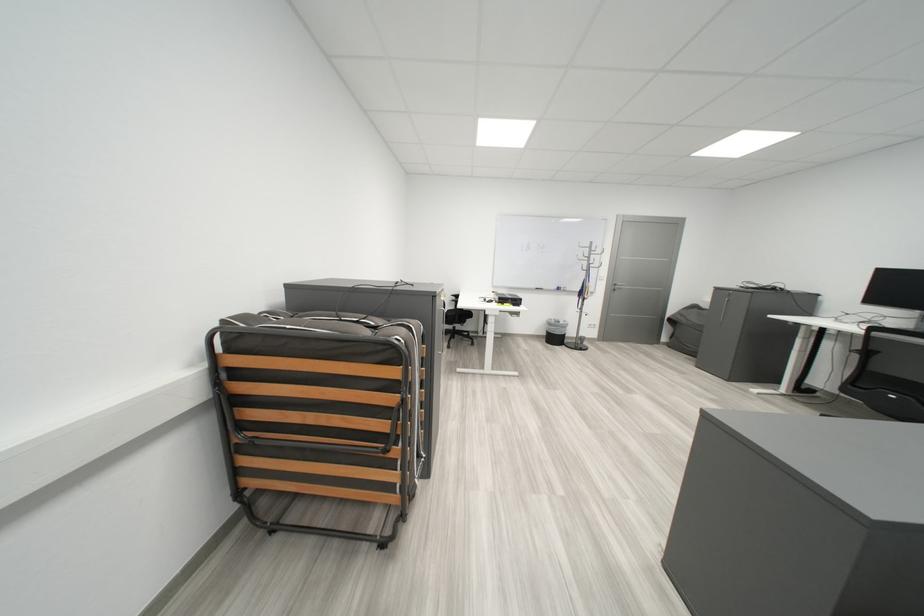
This screenshot has height=616, width=924. Identify the location of gray door handle. (723, 307).